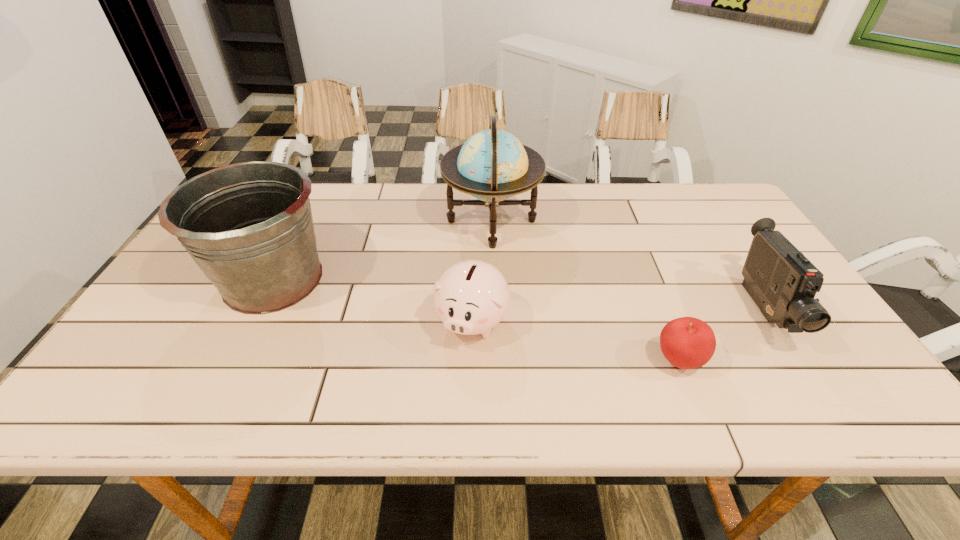
Where is `the tallest object`? Image resolution: width=960 pixels, height=540 pixels. the tallest object is located at coordinates (492, 165).

The width and height of the screenshot is (960, 540). Identify the location of the fourth shortest object. (248, 226).

Where is `bucket`? This screenshot has height=540, width=960. bucket is located at coordinates 248,226.

At what (x,y) coordinates should I click in order to perform the action: click on camcorder. Please return your answer as a coordinate pair (x, y). Image resolution: width=960 pixels, height=540 pixels. Looking at the image, I should click on (782, 282).

Identify the location of the fourth tallest object. (471, 297).

I want to click on apple, so click(x=686, y=342).

Where is `the fourth object from left to right`? This screenshot has width=960, height=540. the fourth object from left to right is located at coordinates (686, 342).

This screenshot has width=960, height=540. I want to click on free space located 0.130m on the surface of the globe, so click(x=401, y=221).

Where is `vacant space situated 0.210m on the surface of the globe`? vacant space situated 0.210m on the surface of the globe is located at coordinates (375, 221).

Identify the location of vacant space located on the surface of the globe. (336, 221).